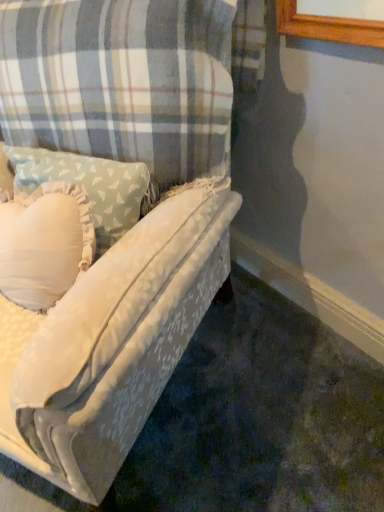
Question: From the image's perspective, is velvet-like fabric couch at center located above or below white soft pillow at center?

Choices:
 (A) above
 (B) below

Answer: (B)

Question: Choose the correct answer: Is velvet-like fabric couch at center inside white soft pillow at center or outside it?

Choices:
 (A) outside
 (B) inside

Answer: (A)

Question: Looking at their shapes, would you say velvet-like fabric couch at center is wider or thinner than white soft pillow at center?

Choices:
 (A) wide
 (B) thin

Answer: (A)

Question: Is point (72, 181) closer or farther from the camera than point (14, 117)?

Choices:
 (A) farther
 (B) closer

Answer: (B)

Question: In the image, is white soft pillow at center on the left side or the right side of velvet-like fabric couch at center?

Choices:
 (A) right
 (B) left

Answer: (A)

Question: In terms of width, does white soft pillow at center look wider or thinner when compared to velvet-like fabric couch at center?

Choices:
 (A) wide
 (B) thin

Answer: (B)

Question: Relative to velvet-like fabric couch at center, is white soft pillow at center in front or behind?

Choices:
 (A) front
 (B) behind

Answer: (B)